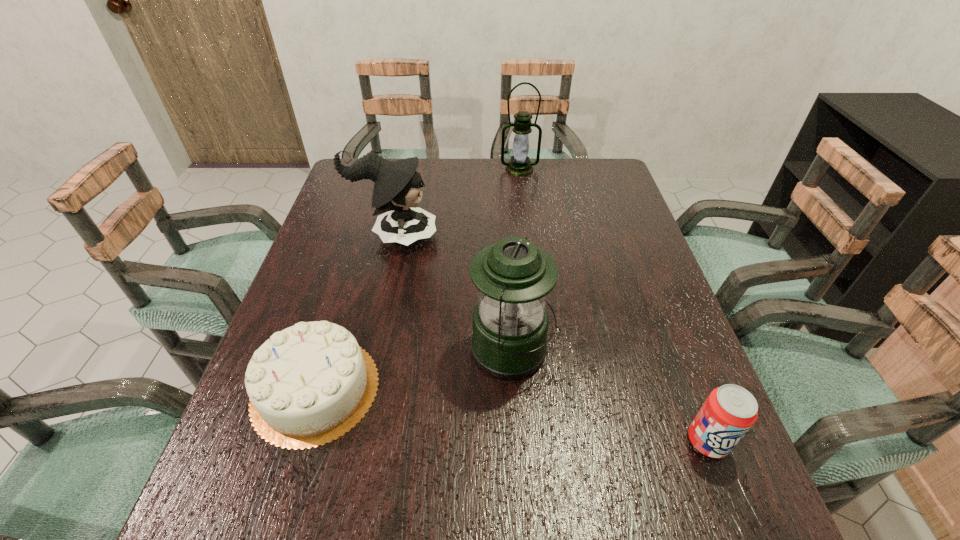
At what (x,y) coordinates should I click in order to perform the action: click on object positioned at the far edge. Please return your answer as a coordinate pair (x, y). This screenshot has width=960, height=540. Looking at the image, I should click on (520, 165).

Where is `doll present at the left edge`? The height and width of the screenshot is (540, 960). doll present at the left edge is located at coordinates (397, 184).

Identify the location of birthday cake situated at the left edge. (309, 384).

The height and width of the screenshot is (540, 960). What are the coordinates of `object located in the right edge section of the desktop` in the screenshot? It's located at (728, 413).

This screenshot has height=540, width=960. I want to click on vacant space at the far edge of the desktop, so pos(419,158).

Image resolution: width=960 pixels, height=540 pixels. In the image, there is a desktop. Find the location of `vacant space at the near edge`. vacant space at the near edge is located at coordinates (362, 537).

Identify the location of vacant space at the left edge of the desktop. This screenshot has height=540, width=960. (334, 217).

At what (x,y) coordinates should I click in order to perform the action: click on free region at the right edge. Please return your answer as a coordinate pair (x, y). The height and width of the screenshot is (540, 960). Looking at the image, I should click on (679, 353).

Where is `vacant space at the near left corner of the desktop`? vacant space at the near left corner of the desktop is located at coordinates (227, 518).

In the image, there is a desktop. Identify the location of vacant space at the far right corner. This screenshot has width=960, height=540. (593, 186).